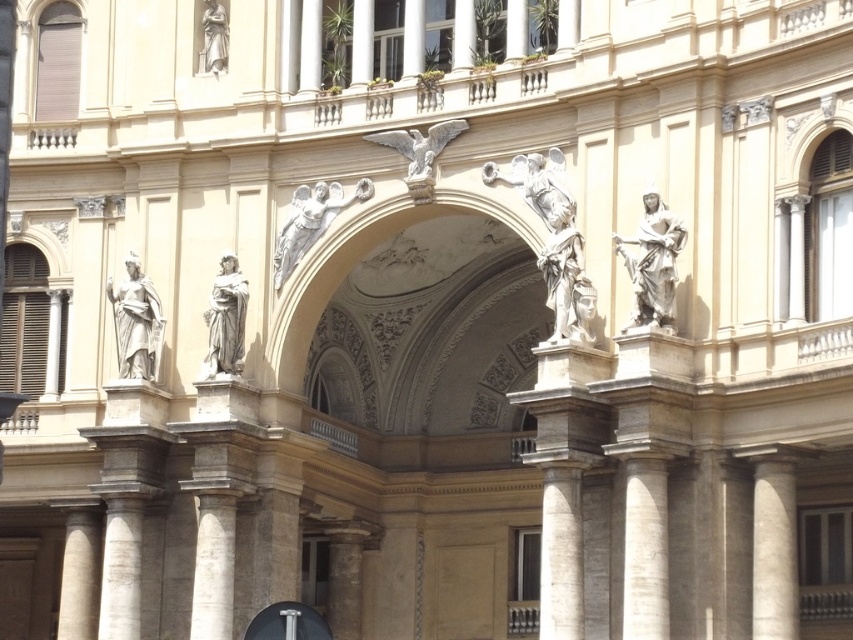
Based on the photo, you are an art conservator assessing the placement of statues on the building facade. The matte stone statue at left and the white marble statue at upper center are both part of the architectural design. Based on their positions, which statue is positioned higher up on the building?

The white marble statue at upper center is positioned higher up on the building than the matte stone statue at left, as the matte stone statue at left is located below it.

You are an architect examining the building facade. You notice a matte stone statue at left located at point (136, 323). Is there any other object at that exact coordinate?

Yes, the matte stone statue at left is located at point (136, 323).

You are an architect examining the building facade. You notice the white marble angel at center and the metallic silver signpost at center. Which object has a smaller width?

The white marble angel at center is thinner than the metallic silver signpost at center, so the white marble angel at center has a smaller width.